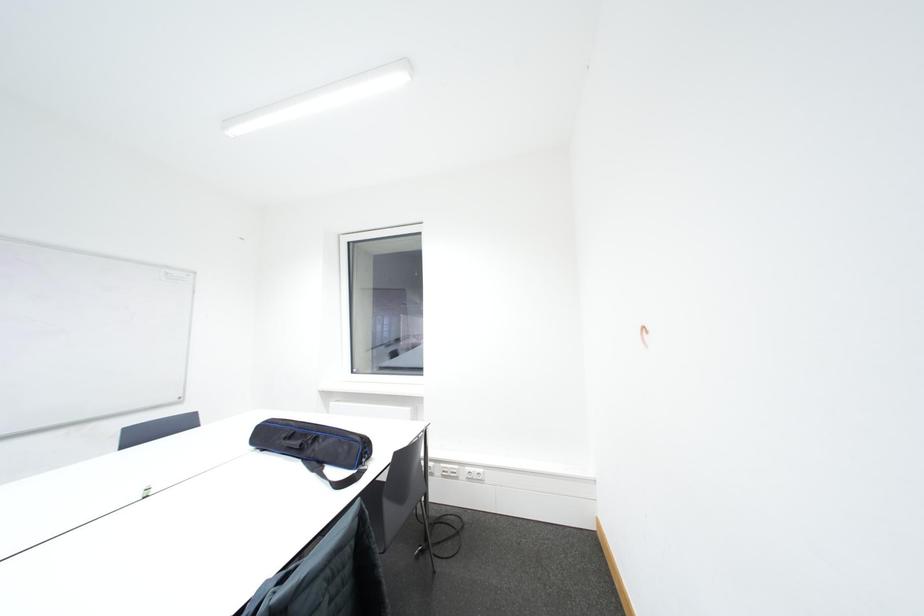
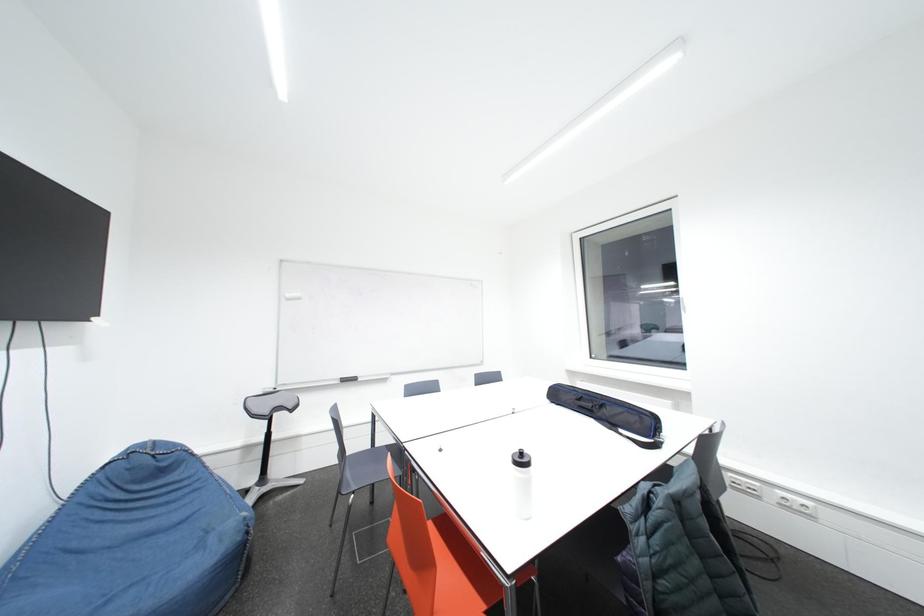
Question: The images are taken continuously from a first-person perspective. In which direction is your viewpoint rotating?

Choices:
 (A) Left
 (B) Right
 (C) Up
 (D) Down

Answer: (A)